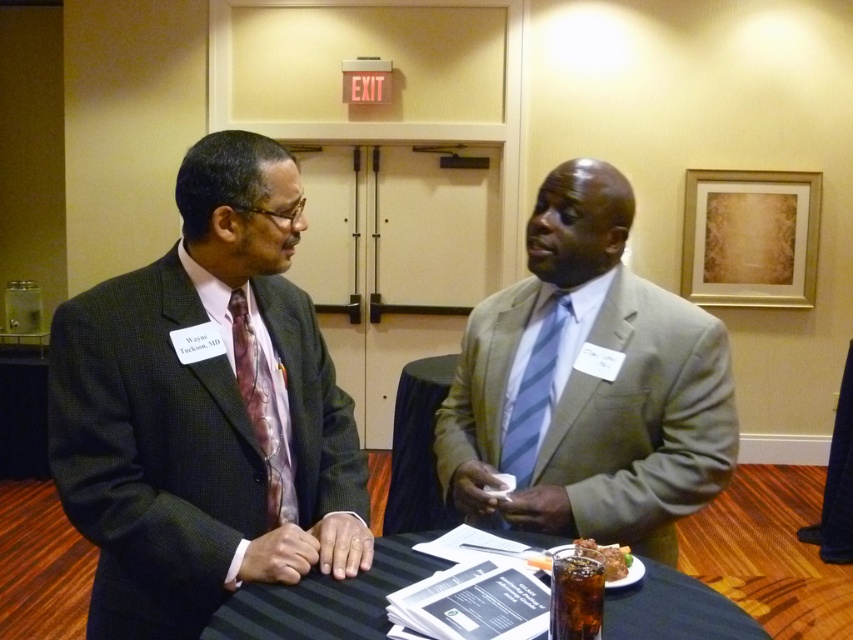
Is matte black suit at left smaller than brown crispy chicken at center?

No.

Is matte black suit at left thinner than brown crispy chicken at center?

No, matte black suit at left is not thinner than brown crispy chicken at center.

The width and height of the screenshot is (853, 640). I want to click on matte black suit at left, so click(206, 410).

Does matte black suit at left appear over light gray suit at center?

Incorrect, matte black suit at left is not positioned above light gray suit at center.

Measure the distance between point (279, 182) and camera.

They are 1.31 meters apart.

Which is in front, point (332, 467) or point (642, 317)?

Point (332, 467)

Where is `matte black suit at left`? matte black suit at left is located at coordinates [206, 410].

Who is taller, matte black suit at left or black fabric table at center?

Standing taller between the two is matte black suit at left.

Who is higher up, matte black suit at left or black fabric table at center?

matte black suit at left

Where is `matte black suit at left`? matte black suit at left is located at coordinates (206, 410).

The image size is (853, 640). I want to click on matte black suit at left, so tap(206, 410).